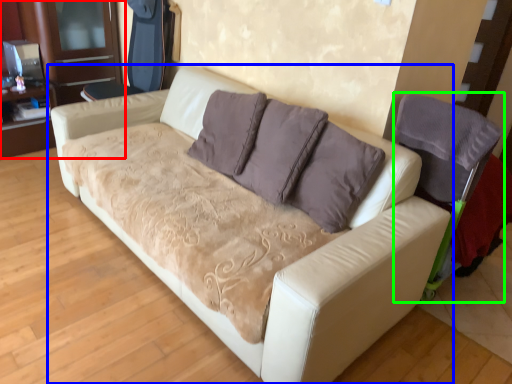
Question: Estimate the real-world distances between objects in this image. Which object is closer to dresser (highlighted by a red box), studio couch (highlighted by a blue box) or armchair (highlighted by a green box)?

Choices:
 (A) studio couch
 (B) armchair

Answer: (A)